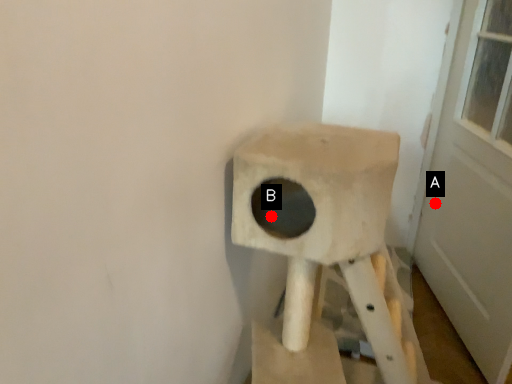
Question: Two points are circled on the image, labeled by A and B beside each circle. Which of the following is the farthest from the observer?

Choices:
 (A) A is further
 (B) B is further

Answer: (A)